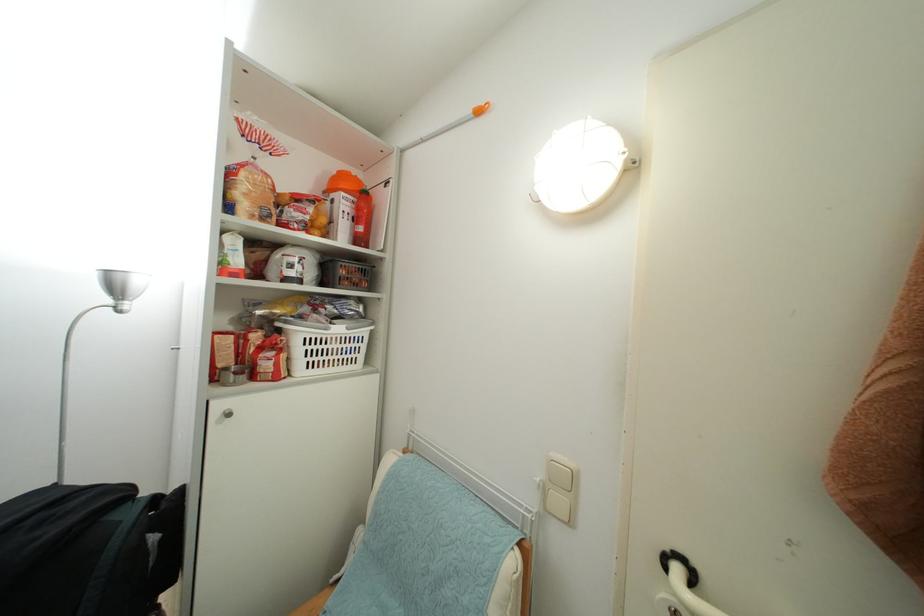
Where is `small cabinet knob`? small cabinet knob is located at coordinates (226, 413).